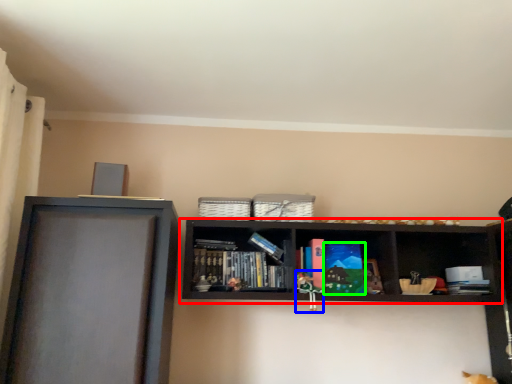
Question: Which object is positioned farthest from shelf (highlighted by a red box)? Select from toy (highlighted by a blue box) and paperback book (highlighted by a green box).

Choices:
 (A) toy
 (B) paperback book

Answer: (A)